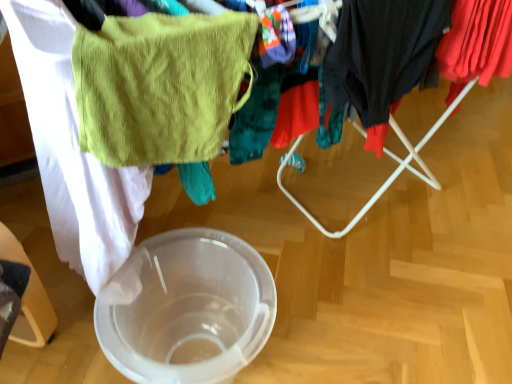
The width and height of the screenshot is (512, 384). I want to click on transparent plastic bowl at center, so click(190, 308).

You are a GUI agent. You are given a task and a screenshot of the screen. Output one action in this format:
    pyautogui.click(x=<x>, y=<y>)
    Task: Click on the green terry cloth towel at upper left
    Image resolution: width=512 pixels, height=384 pixels.
    Given the screenshot: What is the action you would take?
    pyautogui.click(x=161, y=85)

Describe the element at coordinates (477, 41) in the screenshot. The width and height of the screenshot is (512, 384). I see `red cotton shirt at upper right, arranged as the 2th clothing when viewed from the left` at that location.

Identify the location of dark gray fabric at right, the first clothing from the left. The height and width of the screenshot is (384, 512). (381, 52).

Does red cotton shirt at upper right, arranged as the 2th clothing when viewed from the left, have a lesser height compared to transparent plastic bowl at center?

Yes, red cotton shirt at upper right, arranged as the 2th clothing when viewed from the left, is shorter than transparent plastic bowl at center.

From the picture: Can you confirm if red cotton shirt at upper right, arranged as the 2th clothing when viewed from the left, is thinner than transparent plastic bowl at center?

Indeed, red cotton shirt at upper right, arranged as the 2th clothing when viewed from the left, has a lesser width compared to transparent plastic bowl at center.

How distant is red cotton shirt at upper right, arranged as the 2th clothing when viewed from the left, from transparent plastic bowl at center?

They are 82.86 centimeters apart.

Is red cotton shirt at upper right, arranged as the first clothing when viewed from the right, positioned far away from transparent plastic bowl at center?

They are positioned close to each other.

This screenshot has height=384, width=512. What are the coordinates of `the 2nd clothing below the green terry cloth towel at upper left (from a real-world perspective)` in the screenshot? It's located at (477, 41).

From a real-world perspective, is red cotton shirt at upper right, arranged as the 2th clothing when viewed from the left, beneath green terry cloth towel at upper left?

Yes, from a real-world perspective, red cotton shirt at upper right, arranged as the 2th clothing when viewed from the left, is beneath green terry cloth towel at upper left.

Is red cotton shirt at upper right, arranged as the 2th clothing when viewed from the left, outside of green terry cloth towel at upper left?

Indeed, red cotton shirt at upper right, arranged as the 2th clothing when viewed from the left, is completely outside green terry cloth towel at upper left.

Is point (184, 372) behind point (373, 79)?

No, it is in front of (373, 79).

Is the position of transparent plastic bowl at center less distant than that of dark gray fabric at right, the first clothing from the left?

Yes, it is.

Is there a large distance between dark gray fabric at right, the first clothing from the left, and green terry cloth towel at upper left?

They are positioned close to each other.

Which is in front, point (380, 86) or point (199, 18)?

The point (199, 18) is in front.

I want to click on towel/napkin that is in front of the dark gray fabric at right, the second clothing viewed from the right, so click(161, 85).

Is the position of dark gray fabric at right, the second clothing viewed from the right, more distant than that of green terry cloth towel at upper left?

Yes, it is.

From the image's perspective, is red cotton shirt at upper right, arranged as the first clothing when viewed from the right, above or below dark gray fabric at right, the second clothing viewed from the right?

Clearly, from the image's perspective, red cotton shirt at upper right, arranged as the first clothing when viewed from the right, is above dark gray fabric at right, the second clothing viewed from the right.

Does point (469, 48) lie in front of point (412, 79)?

No, it is behind (412, 79).

Is the depth of red cotton shirt at upper right, arranged as the 2th clothing when viewed from the left, less than that of dark gray fabric at right, the second clothing viewed from the right?

No, red cotton shirt at upper right, arranged as the 2th clothing when viewed from the left, is further to the viewer.

In terms of size, does red cotton shirt at upper right, arranged as the first clothing when viewed from the right, appear bigger or smaller than dark gray fabric at right, the first clothing from the left?

In the image, red cotton shirt at upper right, arranged as the first clothing when viewed from the right, appears to be larger than dark gray fabric at right, the first clothing from the left.

Can you tell me how much green terry cloth towel at upper left and red cotton shirt at upper right, arranged as the 2th clothing when viewed from the left, differ in facing direction?

1.82 degrees.

Looking at this image, considering the sizes of green terry cloth towel at upper left and red cotton shirt at upper right, arranged as the first clothing when viewed from the right, in the image, is green terry cloth towel at upper left bigger or smaller than red cotton shirt at upper right, arranged as the first clothing when viewed from the right,?

Clearly, green terry cloth towel at upper left is smaller in size than red cotton shirt at upper right, arranged as the first clothing when viewed from the right.

Which is more to the left, green terry cloth towel at upper left or red cotton shirt at upper right, arranged as the 2th clothing when viewed from the left?

green terry cloth towel at upper left.

Which object is closer to the camera taking this photo, green terry cloth towel at upper left or red cotton shirt at upper right, arranged as the 2th clothing when viewed from the left?

Positioned in front is green terry cloth towel at upper left.

In the image, there is a transparent plastic bowl at center. Where is `towel/napkin above it (from the image's perspective)`? towel/napkin above it (from the image's perspective) is located at coordinates (161, 85).

Consider the image. How many degrees apart are the facing directions of transparent plastic bowl at center and green terry cloth towel at upper left?

0.28 degrees.

From the image's perspective, is transparent plastic bowl at center below green terry cloth towel at upper left?

Yes, from the image's perspective, transparent plastic bowl at center is beneath green terry cloth towel at upper left.

From a real-world perspective, is transparent plastic bowl at center located beneath green terry cloth towel at upper left?

Yes, from a real-world perspective, transparent plastic bowl at center is under green terry cloth towel at upper left.

Identify the location of glass bowl in front of the red cotton shirt at upper right, arranged as the 2th clothing when viewed from the left. The width and height of the screenshot is (512, 384). (190, 308).

I want to click on towel/napkin above the red cotton shirt at upper right, arranged as the first clothing when viewed from the right (from a real-world perspective), so click(161, 85).

Based on the photo, when comparing their distances from dark gray fabric at right, the second clothing viewed from the right, does transparent plastic bowl at center or green terry cloth towel at upper left seem further?

Based on the image, transparent plastic bowl at center appears to be further to dark gray fabric at right, the second clothing viewed from the right.

Estimate the real-world distances between objects in this image. Which object is further from green terry cloth towel at upper left, dark gray fabric at right, the first clothing from the left, or red cotton shirt at upper right, arranged as the first clothing when viewed from the right?

red cotton shirt at upper right, arranged as the first clothing when viewed from the right, lies further to green terry cloth towel at upper left than the other object.

From the picture: Which object lies further to the anchor point dark gray fabric at right, the second clothing viewed from the right, red cotton shirt at upper right, arranged as the first clothing when viewed from the right, or green terry cloth towel at upper left?

green terry cloth towel at upper left is further to dark gray fabric at right, the second clothing viewed from the right.

Based on their spatial positions, is red cotton shirt at upper right, arranged as the 2th clothing when viewed from the left, or dark gray fabric at right, the second clothing viewed from the right, further from transparent plastic bowl at center?

Based on the image, red cotton shirt at upper right, arranged as the 2th clothing when viewed from the left, appears to be further to transparent plastic bowl at center.

Based on their spatial positions, is red cotton shirt at upper right, arranged as the 2th clothing when viewed from the left, or green terry cloth towel at upper left further from transparent plastic bowl at center?

red cotton shirt at upper right, arranged as the 2th clothing when viewed from the left, lies further to transparent plastic bowl at center than the other object.

Which object lies further to the anchor point green terry cloth towel at upper left, red cotton shirt at upper right, arranged as the 2th clothing when viewed from the left, or dark gray fabric at right, the first clothing from the left?

Based on the image, red cotton shirt at upper right, arranged as the 2th clothing when viewed from the left, appears to be further to green terry cloth towel at upper left.

From the image, which object appears to be farther from transparent plastic bowl at center, dark gray fabric at right, the first clothing from the left, or green terry cloth towel at upper left?

The object further to transparent plastic bowl at center is dark gray fabric at right, the first clothing from the left.

Looking at the image, which one is located further to green terry cloth towel at upper left, transparent plastic bowl at center or dark gray fabric at right, the first clothing from the left?

Among the two, transparent plastic bowl at center is located further to green terry cloth towel at upper left.

This screenshot has width=512, height=384. What are the coordinates of `clothing between transparent plastic bowl at center and red cotton shirt at upper right, arranged as the first clothing when viewed from the right, in the horizontal direction` in the screenshot? It's located at (381, 52).

Locate an element on the screen. The width and height of the screenshot is (512, 384). clothing between green terry cloth towel at upper left and red cotton shirt at upper right, arranged as the 2th clothing when viewed from the left, in the horizontal direction is located at coordinates (381, 52).

Where is `towel/napkin situated between transparent plastic bowl at center and red cotton shirt at upper right, arranged as the 2th clothing when viewed from the left, from left to right`? The height and width of the screenshot is (384, 512). towel/napkin situated between transparent plastic bowl at center and red cotton shirt at upper right, arranged as the 2th clothing when viewed from the left, from left to right is located at coordinates (161, 85).

You are a GUI agent. You are given a task and a screenshot of the screen. Output one action in this format:
    pyautogui.click(x=<x>, y=<y>)
    Task: Click on the towel/napkin between dark gray fabric at right, the first clothing from the left, and transparent plastic bowl at center from top to bottom
    
    Given the screenshot: What is the action you would take?
    pyautogui.click(x=161, y=85)